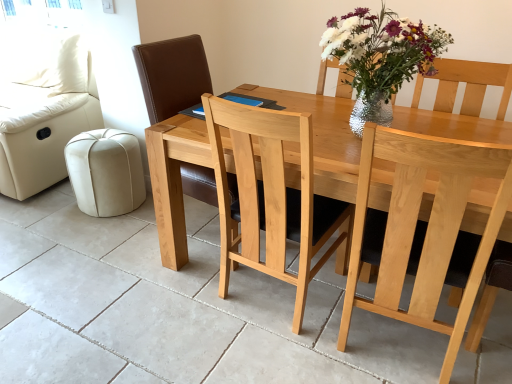
This screenshot has width=512, height=384. What are the coordinates of `free spot in front of beige leather ottoman at lower left` in the screenshot? It's located at (67, 236).